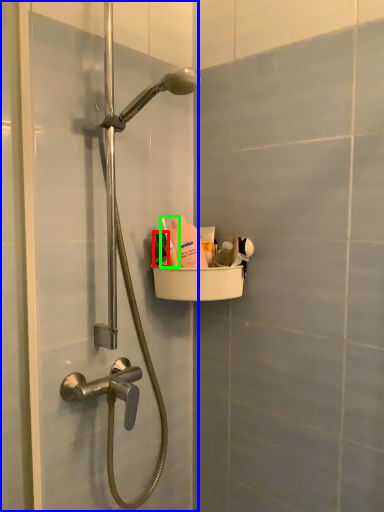
Question: Based on their relative distances, which object is nearer to mouthwash (highlighted by a red box)? Choose from screen door (highlighted by a blue box) and toiletry (highlighted by a green box).

Choices:
 (A) screen door
 (B) toiletry

Answer: (B)